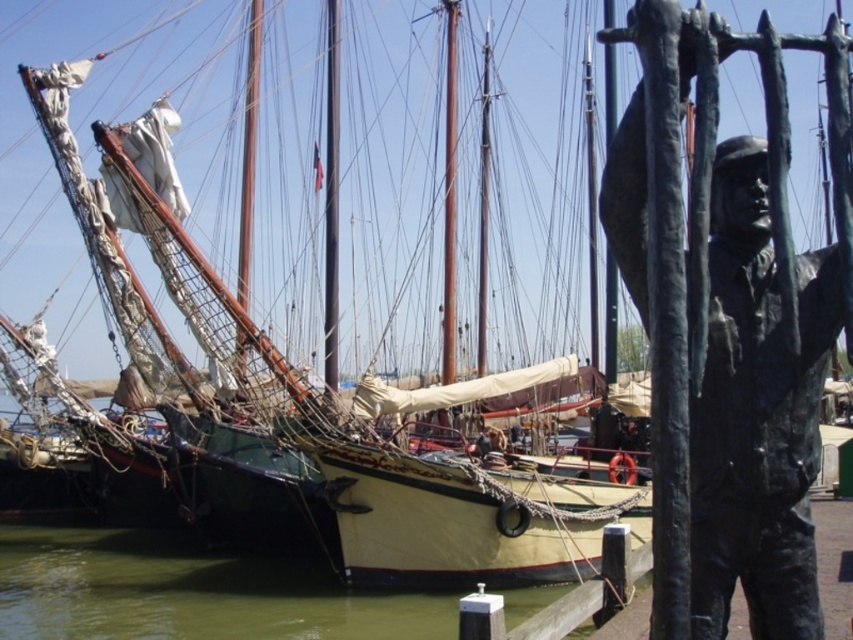
How far apart are green matte sailboat at center and bronze statue at right?

green matte sailboat at center and bronze statue at right are 30.86 meters apart from each other.

How much distance is there between green matte sailboat at center and bronze statue at right?

They are 30.86 meters apart.

Is point (395, 308) farther from camera compared to point (689, 44)?

Yes, point (395, 308) is farther from viewer.

Locate an element on the screen. green matte sailboat at center is located at coordinates (305, 392).

Can you confirm if bronze statue at right is positioned to the right of green water at lower left?

Indeed, bronze statue at right is positioned on the right side of green water at lower left.

Who is shorter, bronze statue at right or green water at lower left?

green water at lower left is shorter.

Locate an element on the screen. The image size is (853, 640). bronze statue at right is located at coordinates (727, 333).

Is green matte sailboat at center shorter than green water at lower left?

In fact, green matte sailboat at center may be taller than green water at lower left.

Is point (370, 522) behind point (194, 582)?

No.

Locate an element on the screen. green matte sailboat at center is located at coordinates (305, 392).